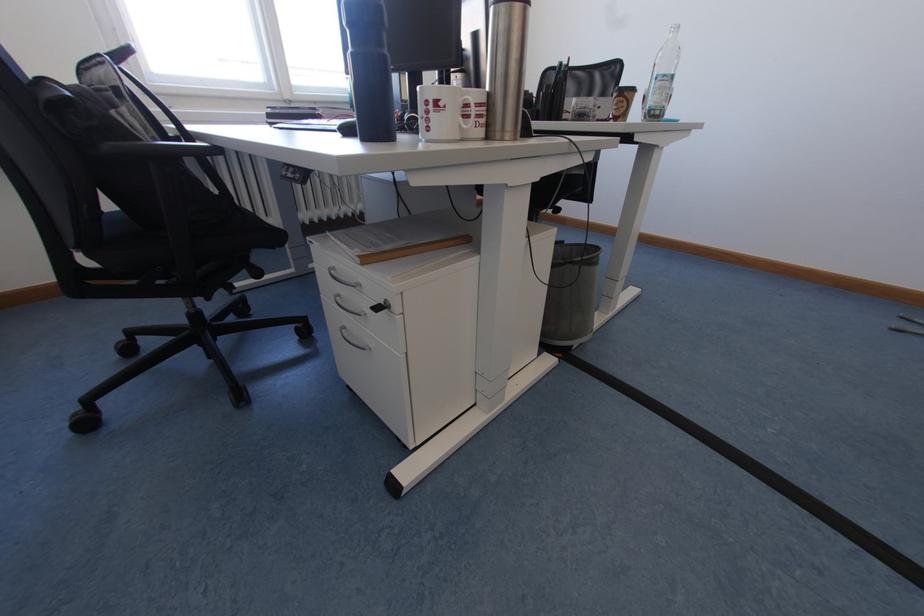
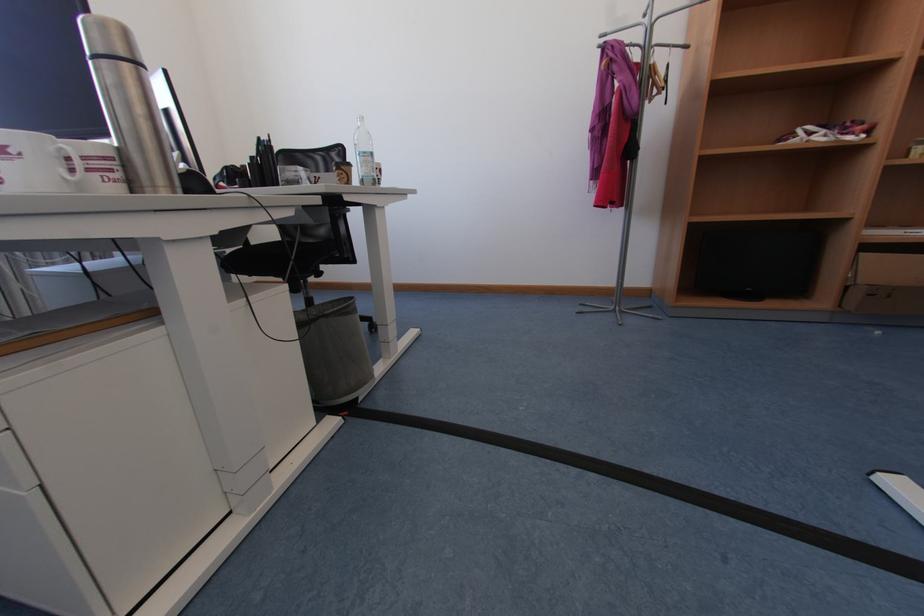
The point at (468, 128) is marked in the first image. Where is the corresponding point in the second image?

(71, 180)